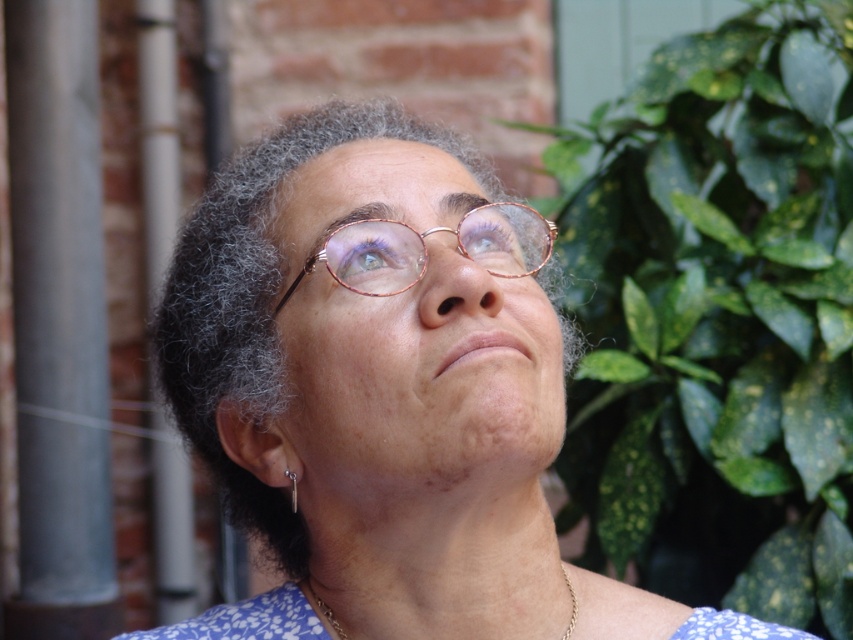
You are an artist sketching this portrait. You need to decide the order to draw the elements based on their positions. Which should you draw first, the gray curly hair at center or the purple matte eye at upper center?

The purple matte eye at upper center should be drawn first because it is positioned above the gray curly hair at center.

What is located at the point with coordinates (258, 301) in the image?

The point at coordinates (258, 301) marks the gray curly hair at center.